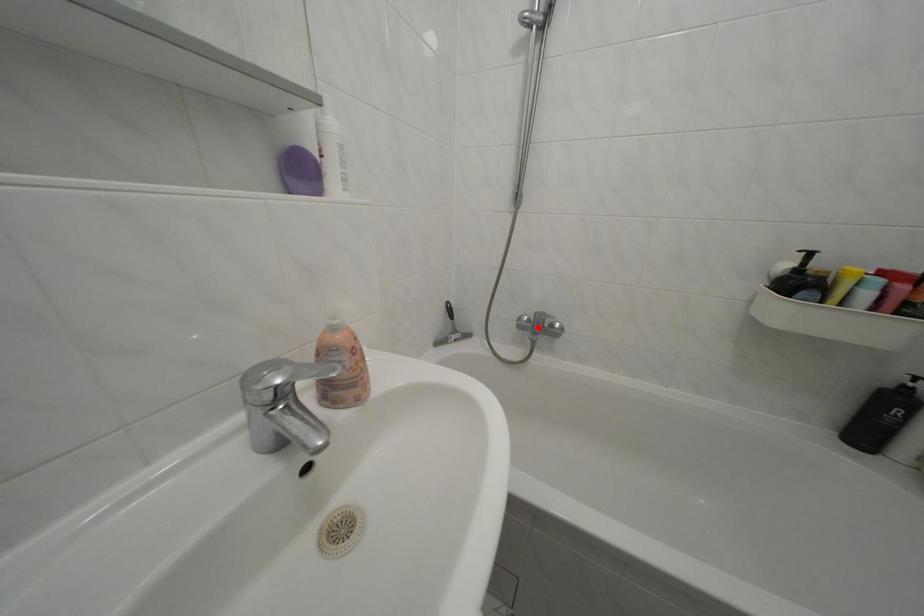
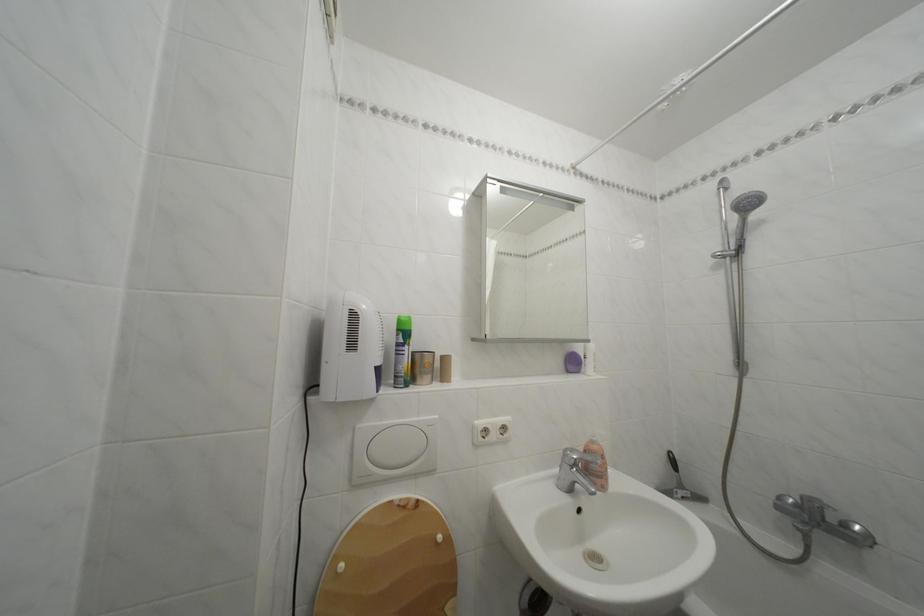
Where in the second image is the point corresponding to the highlighted location from the first image?

(806, 512)